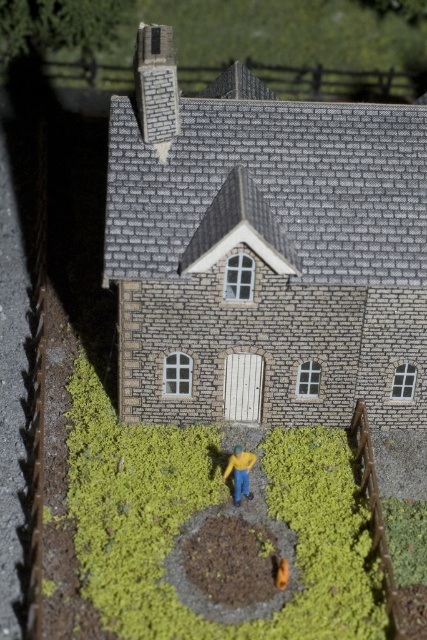
Question: Is yellow matte jacket at center positioned at the back of orange matte toy at center?

Choices:
 (A) no
 (B) yes

Answer: (B)

Question: Is the position of yellow matte jacket at center less distant than that of orange matte toy at center?

Choices:
 (A) yes
 (B) no

Answer: (B)

Question: Which point is farther from the camera taking this photo?

Choices:
 (A) (x=249, y=492)
 (B) (x=280, y=582)

Answer: (A)

Question: Does yellow matte jacket at center have a larger size compared to orange matte toy at center?

Choices:
 (A) yes
 (B) no

Answer: (A)

Question: Among these points, which one is nearest to the camera?

Choices:
 (A) (286, 560)
 (B) (239, 452)

Answer: (A)